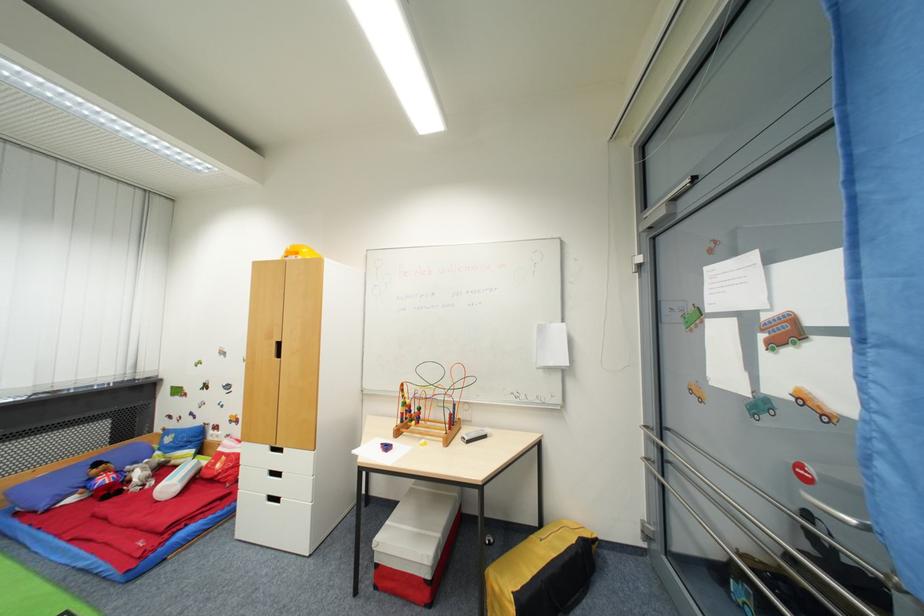
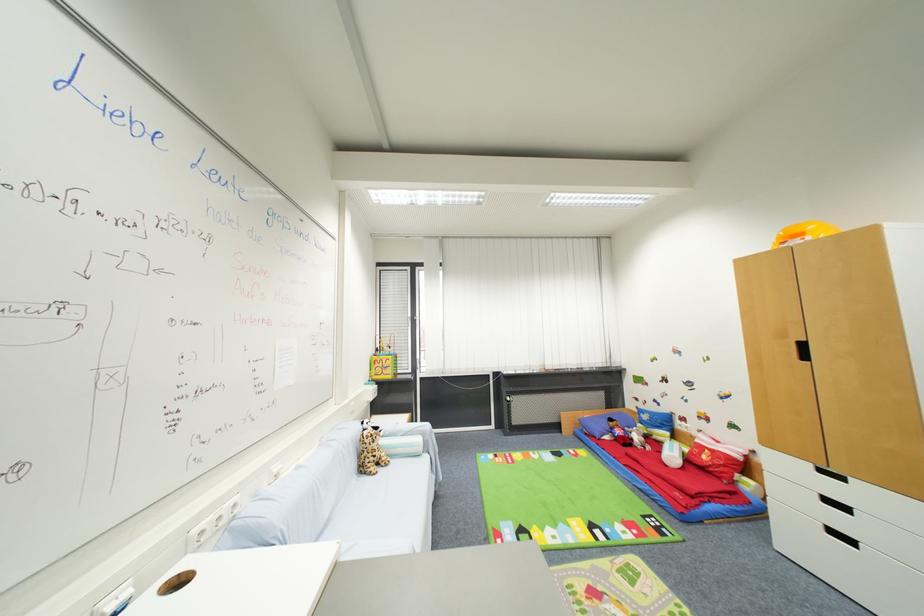
Find the pixel in the second image that matches point 178,464 in the first image.

(660, 439)